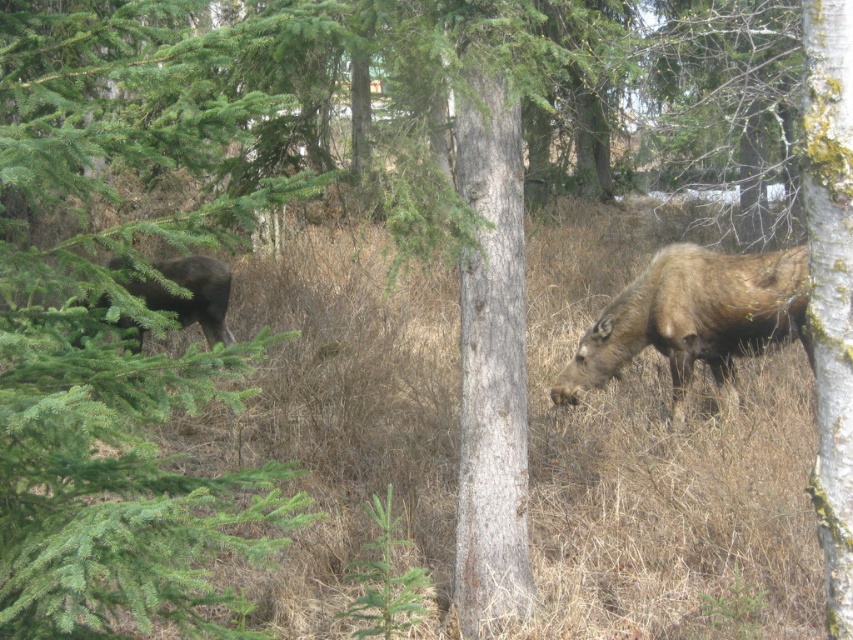
Image resolution: width=853 pixels, height=640 pixels. I want to click on brown furry moose at right, so point(694,317).

Which of these two, brown furry moose at right or dark brown fur at left, stands shorter?

dark brown fur at left is shorter.

What do you see at coordinates (694, 317) in the screenshot?
I see `brown furry moose at right` at bounding box center [694, 317].

I want to click on brown furry moose at right, so click(x=694, y=317).